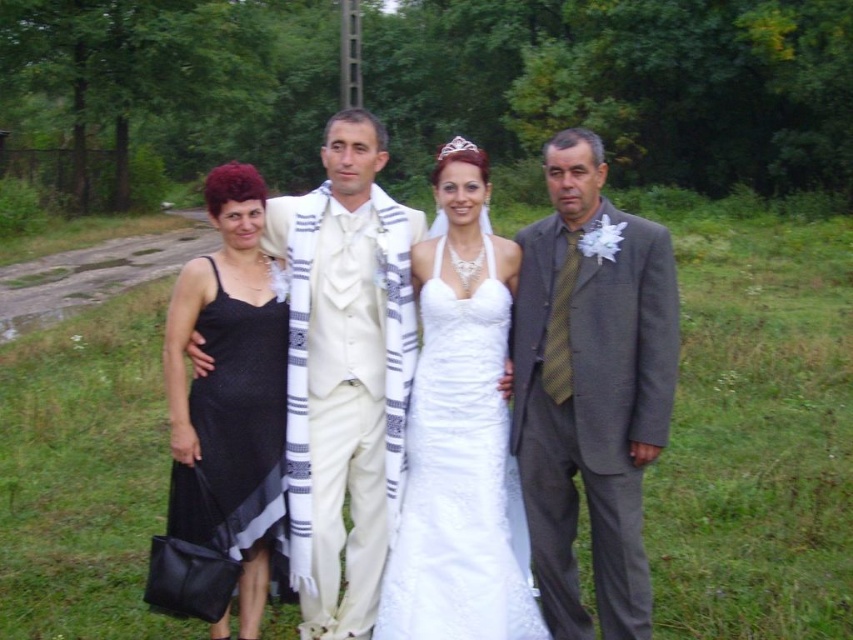
You are standing in the rural setting and want to find the white satin dress at center. According to the coordinates given, where should you look?

The white satin dress at center is located at the 2D coordinates point (590, 385).

Consider the image. You are a photographer adjusting the camera focus for a group photo. The white satin dress at center and the silver metallic tiara at upper center are both in the frame. Which object is shorter in height?

The white satin dress at center is shorter in height compared to the silver metallic tiara at upper center according to the description.

You are a photographer taking a group photo. You notice two women in the scene wearing white satin dress at center and black satin dress at left. Which one is blocking the view of the other?

The white satin dress at center is in front of the black satin dress at left, so it is blocking the view of the black satin dress at left.